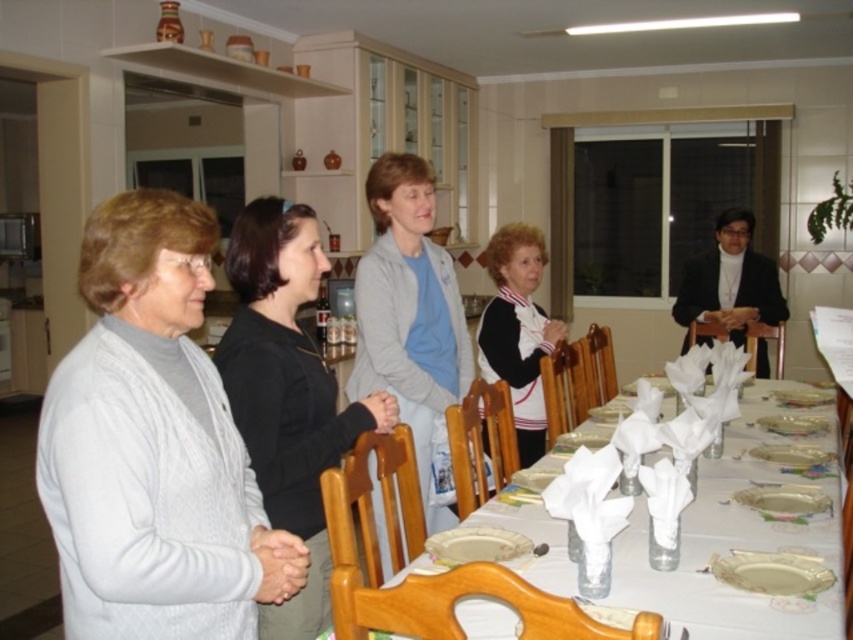
You are a photographer standing at the camera position. You want to capture a closeup shot of the white paper napkin at center without moving the napkin. Can you adjust your position to get a closer shot?

The white paper napkin at center and camera are 1.40 meters apart. To get a closer shot, you can move the camera closer to the napkin. However, since you cannot move the napkin, you can move the camera forward to reduce the distance. However, the question states you cannot move the napkin but doesn not mention if you can move the camera. Assuming you can move the camera, you can get closer. If not, you cannot.

You are standing in the room and want to hand a gift to the person wearing the black matte sweater at center and the black and white sweater at center. Which one can you reach without moving closer?

The black matte sweater at center is closer to the viewer than the black and white sweater at center, so you can reach the person wearing the black matte sweater at center without moving closer.